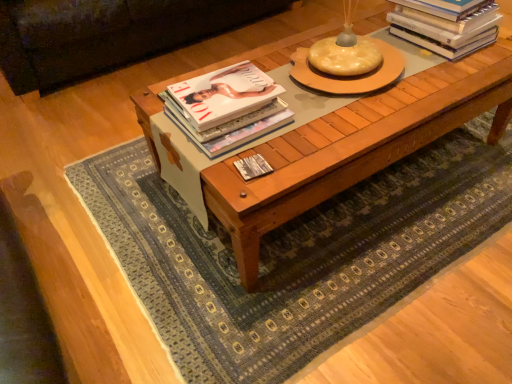
This screenshot has width=512, height=384. Find the location of `vacant space that is in between matte hardcover book at center, placed as the second book when sorted from top to bottom, and white glossy book at center, the 1th book positioned from the bottom`. vacant space that is in between matte hardcover book at center, placed as the second book when sorted from top to bottom, and white glossy book at center, the 1th book positioned from the bottom is located at coordinates (259, 154).